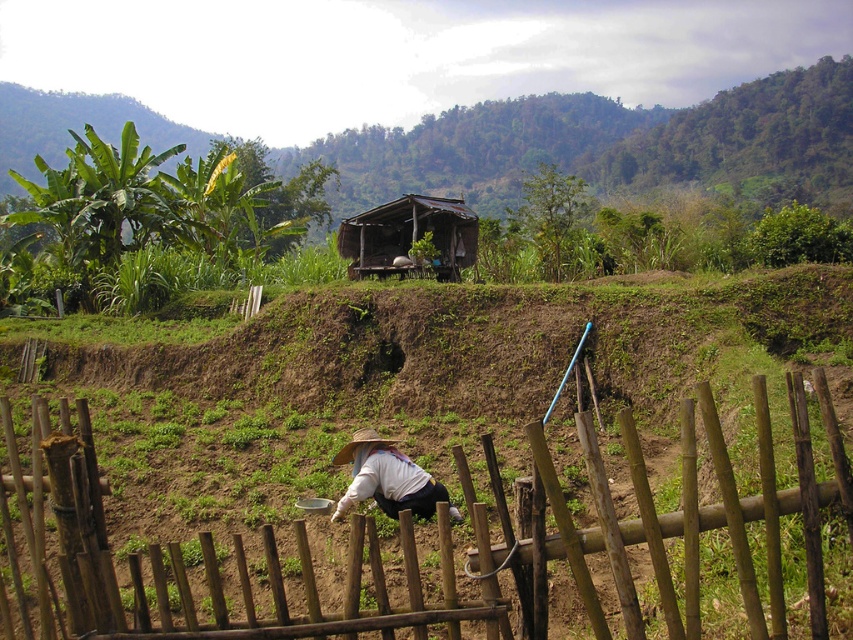
Question: Estimate the real-world distances between objects in this image. Which object is farther from the brown wooden fence at center?

Choices:
 (A) brown thatched hut at center
 (B) white woven hat at lower center

Answer: (A)

Question: Which is nearer to the white woven hat at lower center?

Choices:
 (A) brown thatched hut at center
 (B) brown wooden fence at center

Answer: (B)

Question: Is brown wooden fence at center smaller than white woven hat at lower center?

Choices:
 (A) yes
 (B) no

Answer: (B)

Question: Is brown wooden fence at center thinner than brown thatched hut at center?

Choices:
 (A) no
 (B) yes

Answer: (A)

Question: Is brown wooden fence at center further to camera compared to white woven hat at lower center?

Choices:
 (A) yes
 (B) no

Answer: (B)

Question: Which object is positioned farthest from the white woven hat at lower center?

Choices:
 (A) brown wooden fence at center
 (B) brown thatched hut at center

Answer: (B)